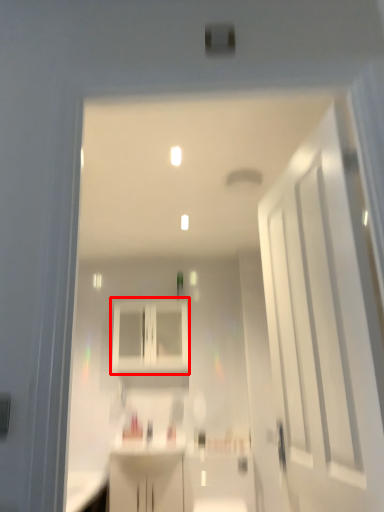
Question: Considering the relative positions of cabinetry (annotated by the red box) and door in the image provided, where is cabinetry (annotated by the red box) located with respect to the staircase?

Choices:
 (A) left
 (B) right

Answer: (A)